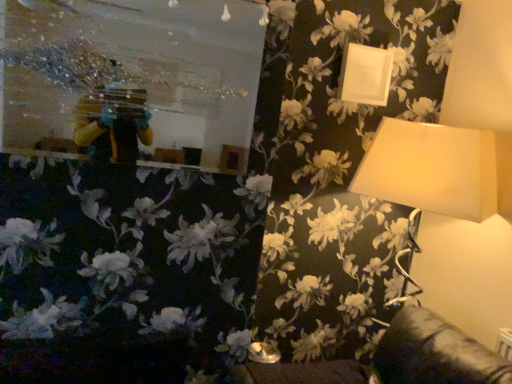
Question: Considering the positions of metallic reflective mirror at upper left and white matte picture frame at upper right in the image, is metallic reflective mirror at upper left wider or thinner than white matte picture frame at upper right?

Choices:
 (A) wide
 (B) thin

Answer: (A)

Question: Is metallic reflective mirror at upper left inside or outside of white matte picture frame at upper right?

Choices:
 (A) outside
 (B) inside

Answer: (A)

Question: Considering the real-world distances, which object is farthest from the metallic reflective mirror at upper left?

Choices:
 (A) matte white lampshade at upper right
 (B) white matte picture frame at upper right

Answer: (A)

Question: Based on their relative distances, which object is farther from the metallic reflective mirror at upper left?

Choices:
 (A) white matte picture frame at upper right
 (B) matte white lampshade at upper right

Answer: (B)